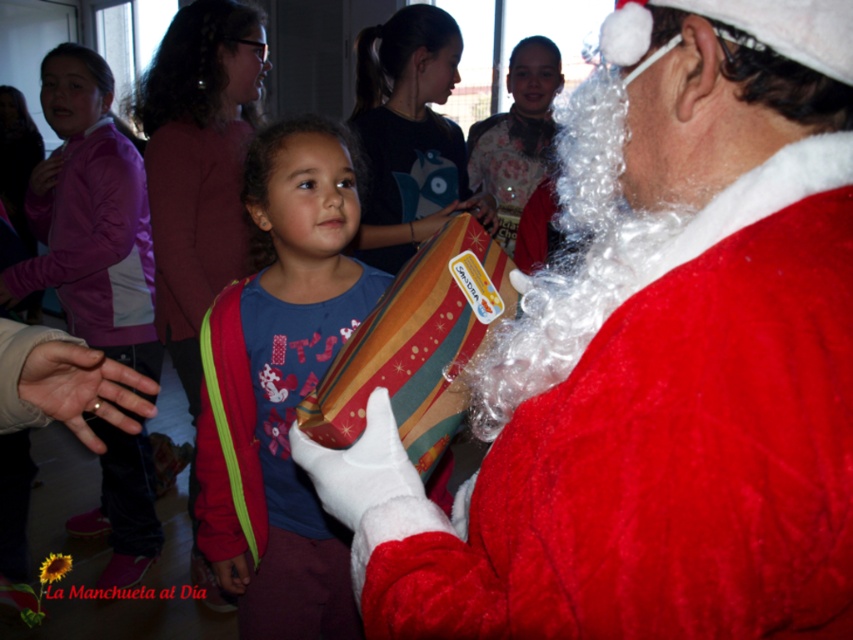
Is matte blue shirt at center in front of striped paper gift at center?

No, matte blue shirt at center is behind striped paper gift at center.

Which of these two, matte blue shirt at center or striped paper gift at center, stands shorter?

striped paper gift at center

Which is in front, point (350, 141) or point (485, 308)?

Positioned in front is point (485, 308).

Where is `matte blue shirt at center`? matte blue shirt at center is located at coordinates (282, 381).

Can you confirm if red velvet santa claus at center is positioned to the right of matte blue shirt at center?

Correct, you'll find red velvet santa claus at center to the right of matte blue shirt at center.

Where is `red velvet santa claus at center`? red velvet santa claus at center is located at coordinates (653, 364).

Does matte blue shirt at center lie in front of striped fabric gift at center?

Yes, matte blue shirt at center is in front of striped fabric gift at center.

Can you confirm if matte blue shirt at center is positioned to the left of striped fabric gift at center?

Yes, matte blue shirt at center is to the left of striped fabric gift at center.

This screenshot has width=853, height=640. Identify the location of matte blue shirt at center. (282, 381).

Identify the location of matte blue shirt at center. Image resolution: width=853 pixels, height=640 pixels. (282, 381).